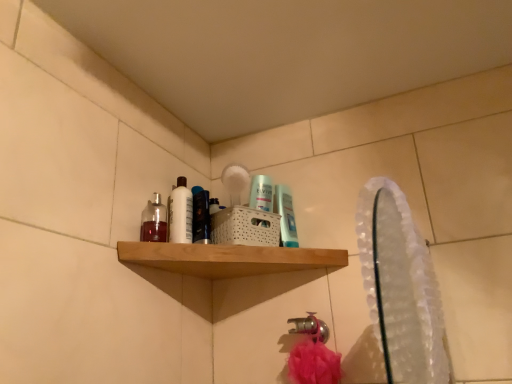
Question: Considering the positions of translucent plastic mouthwash at center, which ranks as the 2th mouthwash in left-to-right order, and translucent plastic mouthwash at upper center, which ranks as the 3th mouthwash in left-to-right order, in the image, is translucent plastic mouthwash at center, which ranks as the 2th mouthwash in left-to-right order, bigger or smaller than translucent plastic mouthwash at upper center, which ranks as the 3th mouthwash in left-to-right order,?

Choices:
 (A) big
 (B) small

Answer: (A)

Question: Looking at their shapes, would you say translucent plastic mouthwash at center, which ranks as the 2th mouthwash in left-to-right order, is wider or thinner than translucent plastic mouthwash at upper center, acting as the first mouthwash starting from the right?

Choices:
 (A) thin
 (B) wide

Answer: (B)

Question: Based on their relative distances, which object is farther from the translucent glass bottle at upper left, which is the third mouthwash in right-to-left order?

Choices:
 (A) translucent plastic mouthwash at upper center, which ranks as the 3th mouthwash in left-to-right order
 (B) translucent plastic mouthwash at center, which ranks as the 2th mouthwash in left-to-right order
 (C) wooden shelf at upper center
 (D) clear plastic mirror at upper right
 (E) white glossy bottle at upper left

Answer: (D)

Question: Based on their relative distances, which object is farther from the translucent plastic mouthwash at upper center, acting as the first mouthwash starting from the right?

Choices:
 (A) white glossy bottle at upper left
 (B) translucent plastic mouthwash at center, which ranks as the 2th mouthwash in left-to-right order
 (C) translucent glass bottle at upper left, which ranks as the 1th mouthwash in left-to-right order
 (D) clear plastic mirror at upper right
 (E) wooden shelf at upper center

Answer: (D)